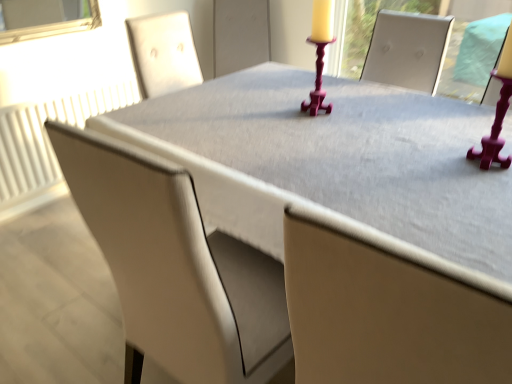
Question: Does matte beige chair at center have a larger size compared to matte gray table at center?

Choices:
 (A) no
 (B) yes

Answer: (B)

Question: Does matte beige chair at center have a lesser height compared to matte gray table at center?

Choices:
 (A) no
 (B) yes

Answer: (A)

Question: From a real-world perspective, is matte beige chair at center positioned under matte gray table at center based on gravity?

Choices:
 (A) no
 (B) yes

Answer: (B)

Question: Is matte beige chair at center further to the viewer compared to matte gray table at center?

Choices:
 (A) no
 (B) yes

Answer: (B)

Question: Does matte beige chair at center have a greater width compared to matte gray table at center?

Choices:
 (A) yes
 (B) no

Answer: (A)

Question: Based on their sizes in the image, would you say matte beige chair at center is bigger or smaller than white textured radiator at left?

Choices:
 (A) small
 (B) big

Answer: (B)

Question: Is point (145, 331) positioned closer to the camera than point (36, 124)?

Choices:
 (A) farther
 (B) closer

Answer: (B)

Question: From their relative heights in the image, would you say matte beige chair at center is taller or shorter than white textured radiator at left?

Choices:
 (A) short
 (B) tall

Answer: (B)

Question: Is matte beige chair at center wider or thinner than white textured radiator at left?

Choices:
 (A) thin
 (B) wide

Answer: (B)

Question: Is matte beige chair at center wider or thinner than matte gray table at center?

Choices:
 (A) thin
 (B) wide

Answer: (B)

Question: Is matte beige chair at center inside the boundaries of matte gray table at center, or outside?

Choices:
 (A) outside
 (B) inside

Answer: (A)

Question: In the image, is matte beige chair at center on the left side or the right side of matte gray table at center?

Choices:
 (A) right
 (B) left

Answer: (B)

Question: Relative to matte gray table at center, is matte beige chair at center in front or behind?

Choices:
 (A) front
 (B) behind

Answer: (B)

Question: Considering the relative positions of white textured radiator at left and matte gray table at center in the image provided, is white textured radiator at left to the left or to the right of matte gray table at center?

Choices:
 (A) left
 (B) right

Answer: (A)

Question: Is white textured radiator at left taller or shorter than matte gray table at center?

Choices:
 (A) tall
 (B) short

Answer: (B)